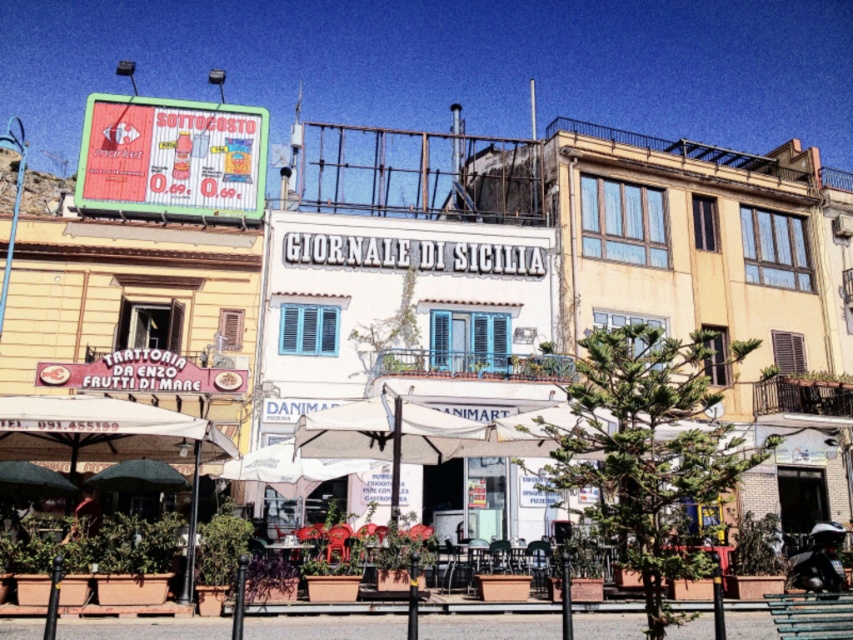
Does green painted wood park bench at lower right have a larger size compared to green fabric umbrella at lower left?

Yes.

Does green painted wood park bench at lower right have a greater width compared to green fabric umbrella at lower left?

Correct, the width of green painted wood park bench at lower right exceeds that of green fabric umbrella at lower left.

Describe the element at coordinates (811, 616) in the screenshot. This screenshot has width=853, height=640. I see `green painted wood park bench at lower right` at that location.

Image resolution: width=853 pixels, height=640 pixels. What are the coordinates of `green painted wood park bench at lower right` in the screenshot? It's located at (811, 616).